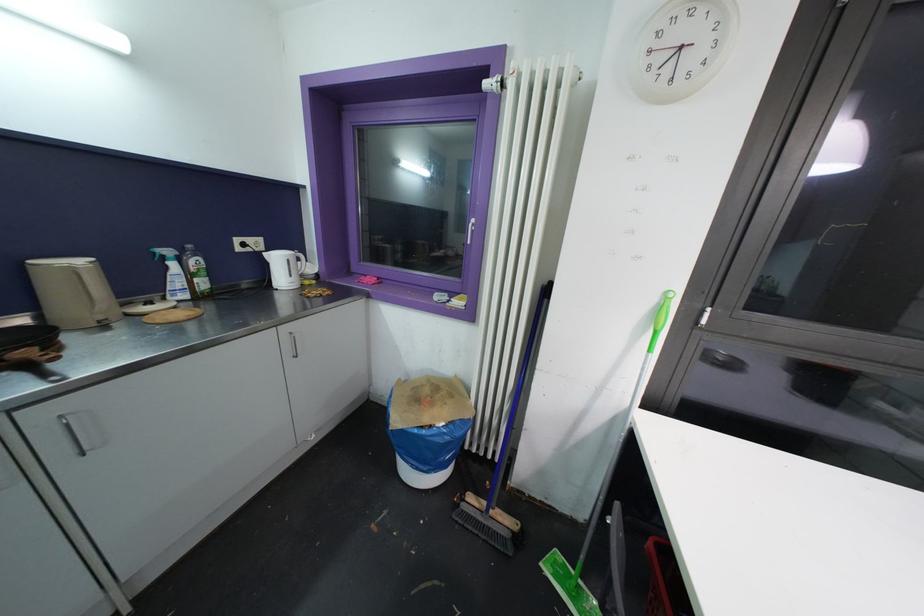
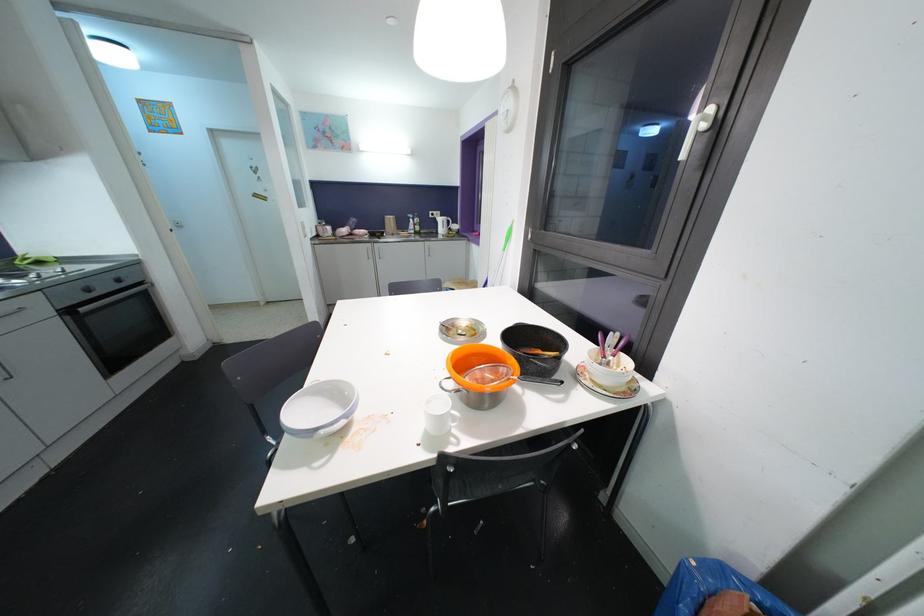
Question: I am providing you with two images of the same scene from different viewpoints. Please identify which objects are invisible in image2.

Choices:
 (A) black bar handle
 (B) radiator control knob
 (C) oven knob
 (D) white ceramic bowl

Answer: (B)